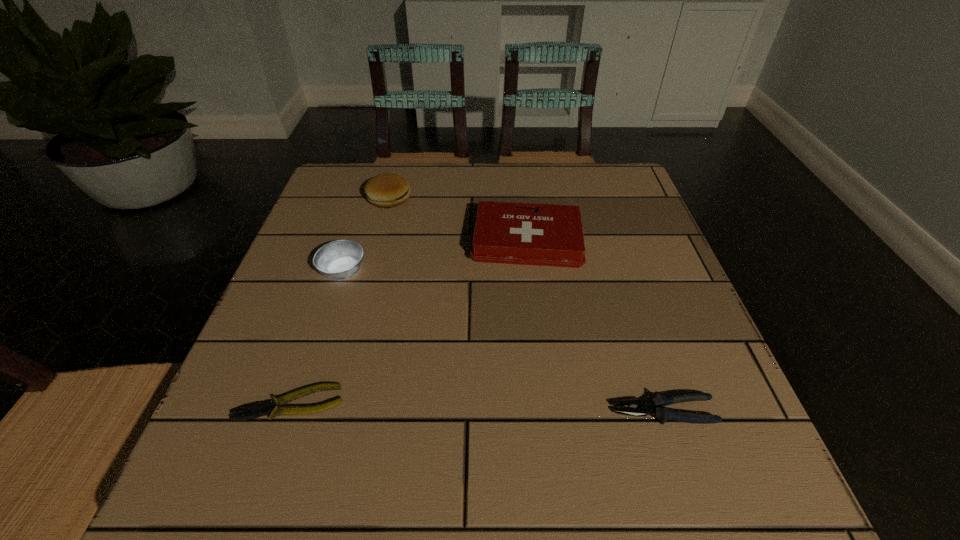
Locate an element on the screen. vacant space located on the front of the ashtray is located at coordinates (290, 436).

Find the location of a particular element. The height and width of the screenshot is (540, 960). free point located 0.300m at the gripping part of the right pliers is located at coordinates click(x=422, y=411).

Locate an element on the screen. free point located at the gripping part of the right pliers is located at coordinates (543, 411).

The width and height of the screenshot is (960, 540). I want to click on vacant space situated 0.340m at the gripping part of the right pliers, so click(x=397, y=411).

Find the location of a particular element. free space located 0.100m on the front of the shortest object is located at coordinates (260, 489).

In order to click on object located at the far edge in this screenshot , I will do `click(387, 190)`.

In order to click on patty at the left edge in this screenshot , I will do `click(387, 190)`.

Locate an element on the screen. This screenshot has width=960, height=540. ashtray present at the left edge is located at coordinates (339, 260).

Find the location of a particular element. pliers that is at the left edge is located at coordinates (259, 409).

Find the location of a particular element. object that is at the right edge is located at coordinates (654, 406).